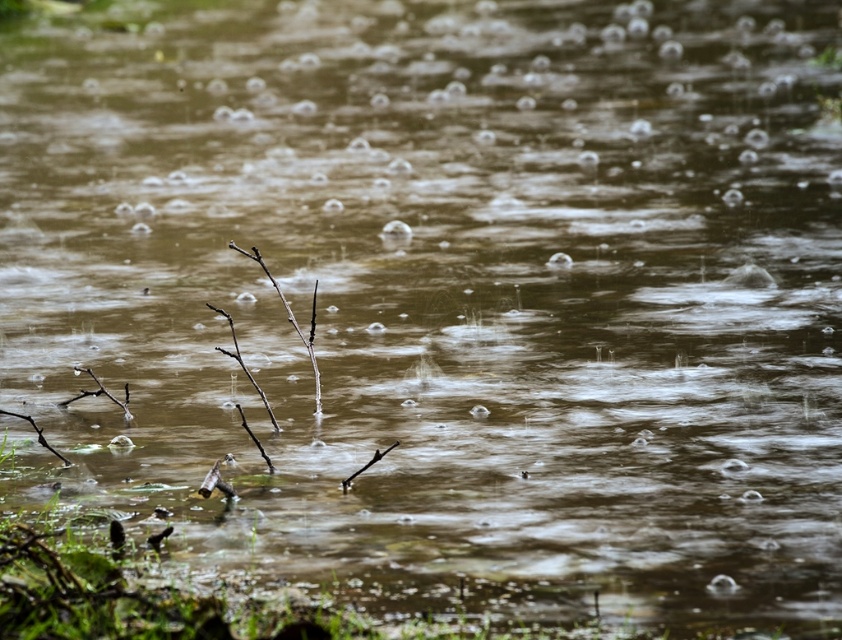
Between point (317, 371) and point (65, 460), which one is positioned in front?

Point (65, 460) is more forward.

Does brown matte branch at center appear under brown twig at lower left?

No.

This screenshot has width=842, height=640. Identify the location of brown matte branch at center. (292, 320).

Image resolution: width=842 pixels, height=640 pixels. I want to click on brown matte branch at center, so click(292, 320).

Measure the distance between brown twig at lower left and camera.

brown twig at lower left is 2.96 meters from camera.

Does brown twig at lower left appear over brown woody branch at center?

Yes, brown twig at lower left is above brown woody branch at center.

This screenshot has height=640, width=842. Find the location of `brown twig at lower left`. brown twig at lower left is located at coordinates (36, 435).

Find the location of a particular element. This screenshot has height=640, width=842. brown twig at lower left is located at coordinates (36, 435).

Does brown matte branch at lower left come behind brown twig at lower left?

That is True.

Does point (113, 397) lie in front of point (62, 456)?

No, (113, 397) is behind (62, 456).

Find the location of a particular element. This screenshot has height=640, width=842. brown matte branch at lower left is located at coordinates (99, 394).